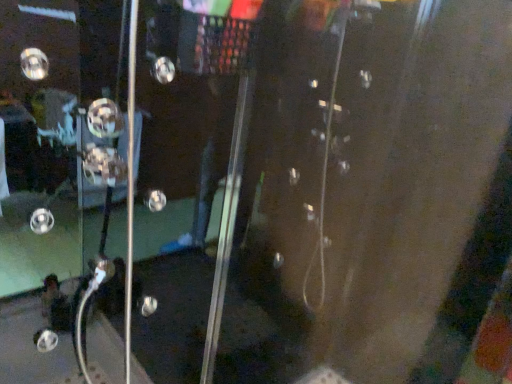
Question: Could you tell me if transparent glass screen door at left is facing metallic knob at center?

Choices:
 (A) yes
 (B) no

Answer: (B)

Question: Is transparent glass screen door at left not near metallic knob at center?

Choices:
 (A) yes
 (B) no

Answer: (B)

Question: Is transparent glass screen door at left positioned behind metallic knob at center?

Choices:
 (A) no
 (B) yes

Answer: (A)

Question: Can you confirm if transparent glass screen door at left is shorter than metallic knob at center?

Choices:
 (A) yes
 (B) no

Answer: (B)

Question: From a real-world perspective, is transparent glass screen door at left physically above metallic knob at center?

Choices:
 (A) no
 (B) yes

Answer: (A)

Question: Considering the relative sizes of transparent glass screen door at left and metallic knob at center in the image provided, is transparent glass screen door at left bigger than metallic knob at center?

Choices:
 (A) no
 (B) yes

Answer: (B)

Question: From a real-world perspective, is metallic knob at center under transparent glass screen door at left?

Choices:
 (A) yes
 (B) no

Answer: (B)

Question: Are metallic knob at center and transparent glass screen door at left far apart?

Choices:
 (A) no
 (B) yes

Answer: (A)

Question: Is metallic knob at center thinner than transparent glass screen door at left?

Choices:
 (A) no
 (B) yes

Answer: (B)

Question: Does metallic knob at center have a greater height compared to transparent glass screen door at left?

Choices:
 (A) no
 (B) yes

Answer: (A)

Question: Is the depth of metallic knob at center less than that of transparent glass screen door at left?

Choices:
 (A) yes
 (B) no

Answer: (B)

Question: Does metallic knob at center come behind transparent glass screen door at left?

Choices:
 (A) yes
 (B) no

Answer: (A)

Question: Which is correct: metallic knob at center is inside transparent glass screen door at left, or outside of it?

Choices:
 (A) outside
 (B) inside

Answer: (B)